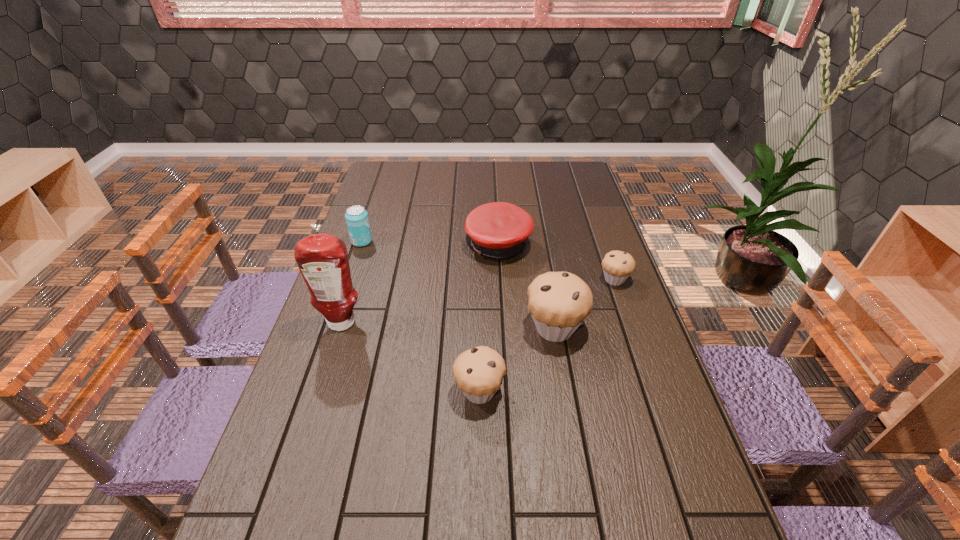
Please point out where to position a new muffin on the left to maintain spacing. Please provide its 2D coordinates. Your answer should be formatted as a tuple, i.e. [(x, y)], where the tuple contains the x and y coordinates of a point satisfying the conditions above.

[(377, 476)]